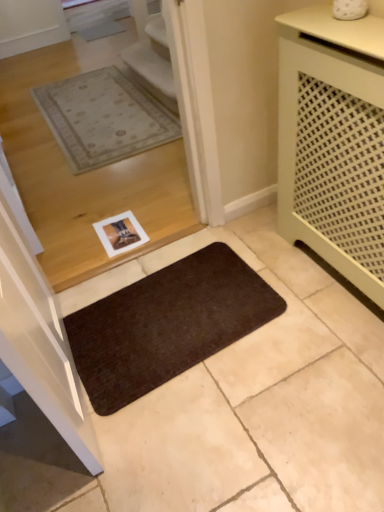
Question: Is the depth of matte green cabinet at right less than that of brown matte mat at lower center?

Choices:
 (A) yes
 (B) no

Answer: (A)

Question: From a real-world perspective, is matte green cabinet at right on brown matte mat at lower center?

Choices:
 (A) no
 (B) yes

Answer: (B)

Question: Can you confirm if matte green cabinet at right is shorter than brown matte mat at lower center?

Choices:
 (A) no
 (B) yes

Answer: (A)

Question: Does matte green cabinet at right have a greater height compared to brown matte mat at lower center?

Choices:
 (A) yes
 (B) no

Answer: (A)

Question: Can we say matte green cabinet at right lies outside brown matte mat at lower center?

Choices:
 (A) yes
 (B) no

Answer: (A)

Question: Is matte green cabinet at right oriented towards brown matte mat at lower center?

Choices:
 (A) no
 (B) yes

Answer: (B)

Question: Is brown matte mat at lower center outside of matte green cabinet at right?

Choices:
 (A) yes
 (B) no

Answer: (A)

Question: Is brown matte mat at lower center to the right of matte green cabinet at right from the viewer's perspective?

Choices:
 (A) yes
 (B) no

Answer: (B)

Question: From the image's perspective, does brown matte mat at lower center appear higher than matte green cabinet at right?

Choices:
 (A) yes
 (B) no

Answer: (B)

Question: Is brown matte mat at lower center further to camera compared to matte green cabinet at right?

Choices:
 (A) no
 (B) yes

Answer: (B)

Question: Are brown matte mat at lower center and matte green cabinet at right far apart?

Choices:
 (A) yes
 (B) no

Answer: (B)

Question: From a real-world perspective, is brown matte mat at lower center located higher than matte green cabinet at right?

Choices:
 (A) no
 (B) yes

Answer: (A)

Question: Is brown matte mat at lower center spatially inside matte green cabinet at right, or outside of it?

Choices:
 (A) inside
 (B) outside

Answer: (B)